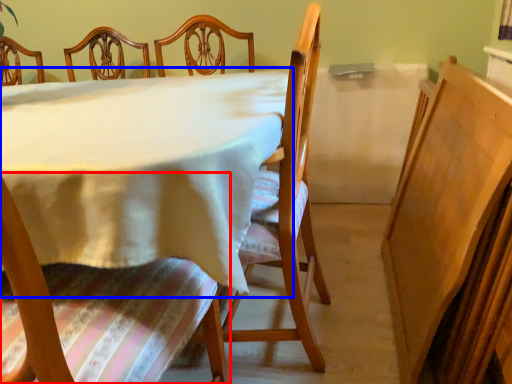
Question: Which of the following is the closest to the observer, chair (highlighted by a red box) or table (highlighted by a blue box)?

Choices:
 (A) chair
 (B) table

Answer: (A)